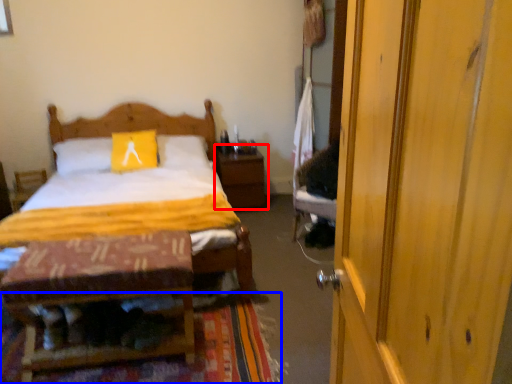
Question: Which object is further to the camera taking this photo, nightstand (highlighted by a red box) or mat (highlighted by a blue box)?

Choices:
 (A) nightstand
 (B) mat

Answer: (A)